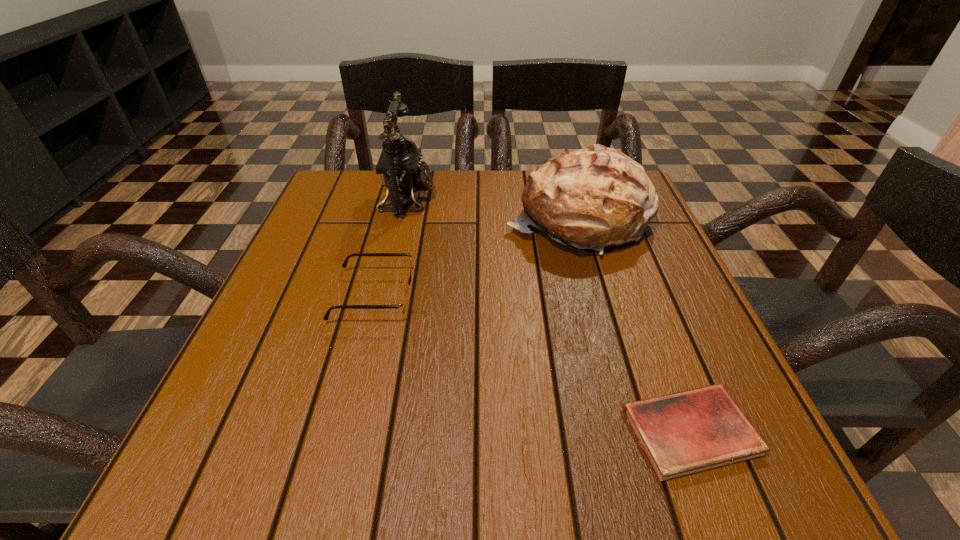
Where is `empty location between the bread and the shortest object`? The image size is (960, 540). empty location between the bread and the shortest object is located at coordinates (634, 325).

The image size is (960, 540). What are the coordinates of `free space between the bread and the nearest object` in the screenshot? It's located at (634, 325).

This screenshot has width=960, height=540. What are the coordinates of `vacant space that's between the bread and the third farthest object` in the screenshot? It's located at (475, 257).

Locate an element on the screen. This screenshot has width=960, height=540. empty location between the nearest object and the third farthest object is located at coordinates (532, 363).

What are the coordinates of `vacant space in between the tallest object and the spectacles` in the screenshot? It's located at (391, 247).

Identify the location of free space that is in between the bread and the tallest object. (492, 209).

Select which object is the second closest to the tallest object. Please provide its 2D coordinates. Your answer should be formatted as a tuple, i.e. [(x, y)], where the tuple contains the x and y coordinates of a point satisfying the conditions above.

[(591, 198)]

At what (x,y) coordinates should I click in order to perform the action: click on object that is the third closest to the bread. Please return your answer as a coordinate pair (x, y). This screenshot has width=960, height=540. Looking at the image, I should click on (683, 433).

Identify the location of vacant region that satisfies the following two spatial constraints: 1. on the back side of the shortest object; 2. at the hinge ends of the spectacles. (638, 295).

In order to click on free spot that satisfies the following two spatial constraints: 1. at the hinge ends of the shortest object; 2. on the right side of the second nearest object in this screenshot , I will do `click(340, 431)`.